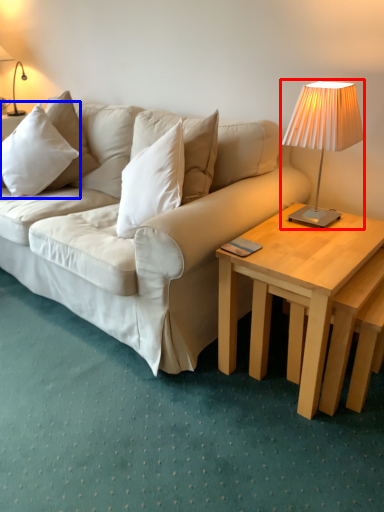
Question: Which object is closer to the camera taking this photo, lamp (highlighted by a red box) or pillow (highlighted by a blue box)?

Choices:
 (A) lamp
 (B) pillow

Answer: (A)